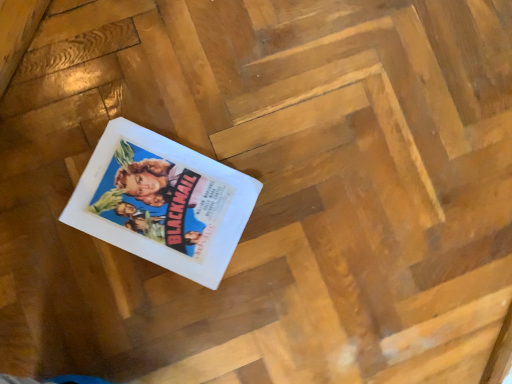
Identify the location of free space in front of white paper at center. (84, 299).